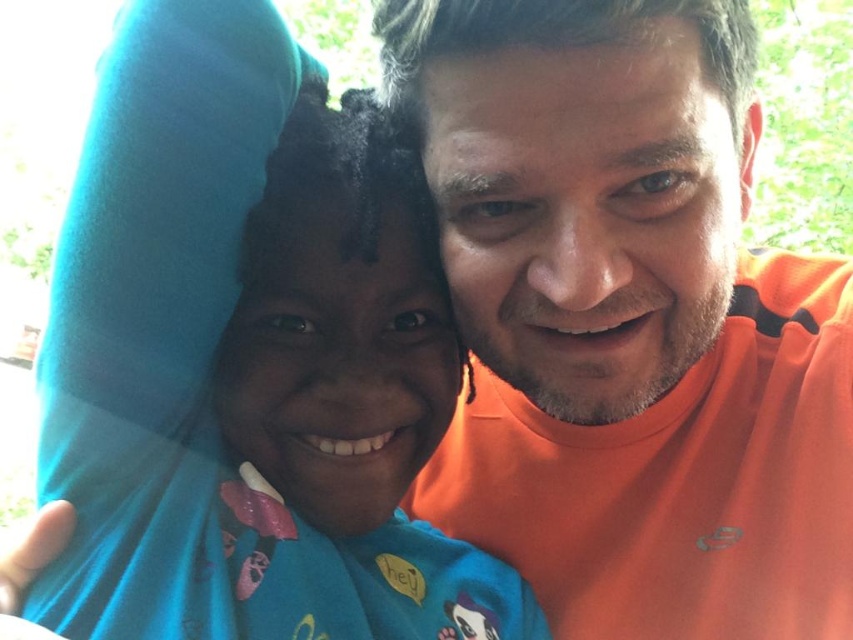
Does orange cotton shirt at center come in front of blue fabric at left?

Yes, orange cotton shirt at center is in front of blue fabric at left.

Between point (817, 460) and point (434, 554), which one is positioned behind?

The point (434, 554) is more distant.

The image size is (853, 640). Find the location of `orange cotton shirt at center`. orange cotton shirt at center is located at coordinates [x=630, y=323].